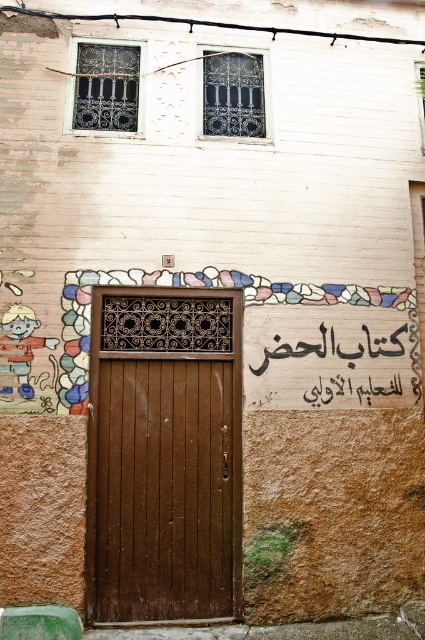
Question: Is brown wooden door at center below wooden sign at center?

Choices:
 (A) yes
 (B) no

Answer: (A)

Question: Which point is closer to the camera?

Choices:
 (A) (379, 346)
 (B) (229, 424)

Answer: (B)

Question: Is brown wooden door at center further to camera compared to wooden sign at center?

Choices:
 (A) no
 (B) yes

Answer: (A)

Question: Considering the relative positions of brown wooden door at center and wooden sign at center in the image provided, where is brown wooden door at center located with respect to wooden sign at center?

Choices:
 (A) above
 (B) below

Answer: (B)

Question: Which of the following is the farthest from the observer?

Choices:
 (A) wooden sign at center
 (B) brown wooden door at center

Answer: (A)